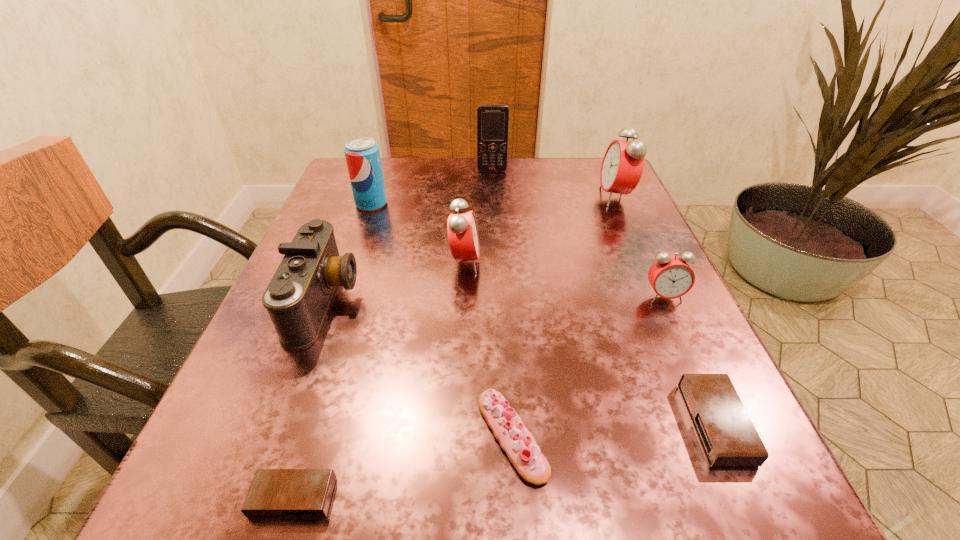
The image size is (960, 540). I want to click on free space at the left edge, so click(364, 214).

Find the location of a particular element. Image resolution: width=960 pixels, height=540 pixels. vacant space at the right edge of the desktop is located at coordinates (635, 385).

Identify the location of vacant area at the far right corner of the desktop. pyautogui.click(x=588, y=200).

Locate an element on the screen. The height and width of the screenshot is (540, 960). blank space at the near right corner of the desktop is located at coordinates (649, 497).

You are a GUI agent. You are given a task and a screenshot of the screen. Output one action in this format:
    pyautogui.click(x=<x>, y=<y>)
    Task: Click on the free space between the second shortest object and the farthest object
    
    Given the screenshot: What is the action you would take?
    pyautogui.click(x=604, y=297)

Find the location of a particular element. vacant area that lies between the second farthest red alarm clock and the smaller black alarm clock is located at coordinates (379, 380).

Identify the location of vacant space in between the eclair and the leftmost red alarm clock. This screenshot has height=540, width=960. (489, 349).

The height and width of the screenshot is (540, 960). Find the location of `free spot between the tallest alarm clock and the soda can`. free spot between the tallest alarm clock and the soda can is located at coordinates (493, 200).

Locate an element on the screen. Image resolution: width=960 pixels, height=540 pixels. unoccupied position between the farthest object and the soda can is located at coordinates (432, 187).

Locate an element on the screen. This screenshot has height=540, width=960. free space between the leftmost red alarm clock and the left black alarm clock is located at coordinates (379, 380).